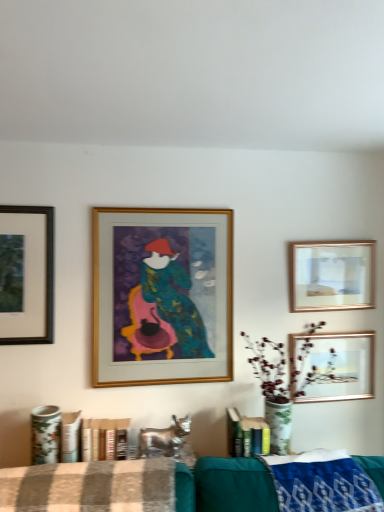
Question: Should I look upward or downward to see matte black frame at upper left, placed as the 4th picture frame when sorted from right to left?

Choices:
 (A) up
 (B) down

Answer: (B)

Question: Does gold metallic picture frame at center, which ranks as the second picture frame in left-to-right order, have a lesser width compared to blue woven blanket at lower right?

Choices:
 (A) no
 (B) yes

Answer: (B)

Question: Is gold metallic picture frame at center, which ranks as the second picture frame in left-to-right order, aimed at blue woven blanket at lower right?

Choices:
 (A) yes
 (B) no

Answer: (B)

Question: Is gold metallic picture frame at center, which is the third picture frame from right to left, looking in the opposite direction of blue woven blanket at lower right?

Choices:
 (A) no
 (B) yes

Answer: (A)

Question: Does gold metallic picture frame at center, which ranks as the second picture frame in left-to-right order, have a greater width compared to blue woven blanket at lower right?

Choices:
 (A) no
 (B) yes

Answer: (A)

Question: Considering the relative sizes of gold metallic picture frame at center, which is the third picture frame from right to left, and blue woven blanket at lower right in the image provided, is gold metallic picture frame at center, which is the third picture frame from right to left, taller than blue woven blanket at lower right?

Choices:
 (A) yes
 (B) no

Answer: (A)

Question: Is gold metallic picture frame at center, which ranks as the second picture frame in left-to-right order, closer to camera compared to blue woven blanket at lower right?

Choices:
 (A) no
 (B) yes

Answer: (A)

Question: Is blue woven blanket at lower right aimed at matte black frame at upper left, placed as the 4th picture frame when sorted from right to left?

Choices:
 (A) yes
 (B) no

Answer: (B)

Question: Can you confirm if blue woven blanket at lower right is smaller than matte black frame at upper left, placed as the 4th picture frame when sorted from right to left?

Choices:
 (A) no
 (B) yes

Answer: (A)

Question: Is blue woven blanket at lower right looking in the opposite direction of matte black frame at upper left, which is the 1th picture frame in left-to-right order?

Choices:
 (A) yes
 (B) no

Answer: (B)

Question: Are blue woven blanket at lower right and matte black frame at upper left, placed as the 4th picture frame when sorted from right to left, located far from each other?

Choices:
 (A) no
 (B) yes

Answer: (B)

Question: Is blue woven blanket at lower right beside matte black frame at upper left, placed as the 4th picture frame when sorted from right to left?

Choices:
 (A) no
 (B) yes

Answer: (A)

Question: Does blue woven blanket at lower right have a lesser height compared to matte black frame at upper left, placed as the 4th picture frame when sorted from right to left?

Choices:
 (A) yes
 (B) no

Answer: (A)

Question: Can you confirm if brown checkered fabric at lower center is smaller than metallic gold picture frame at upper right, the 1th picture frame when ordered from right to left?

Choices:
 (A) yes
 (B) no

Answer: (B)